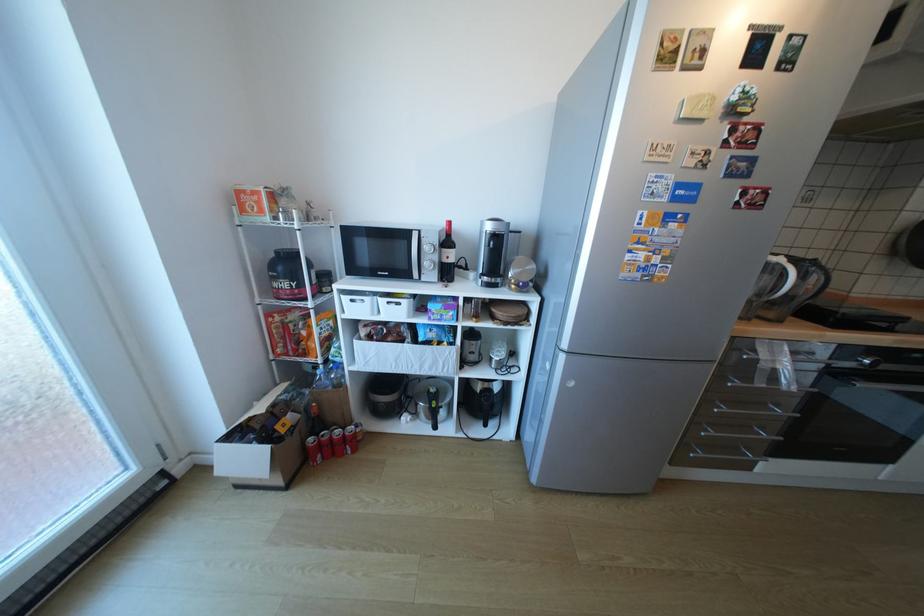
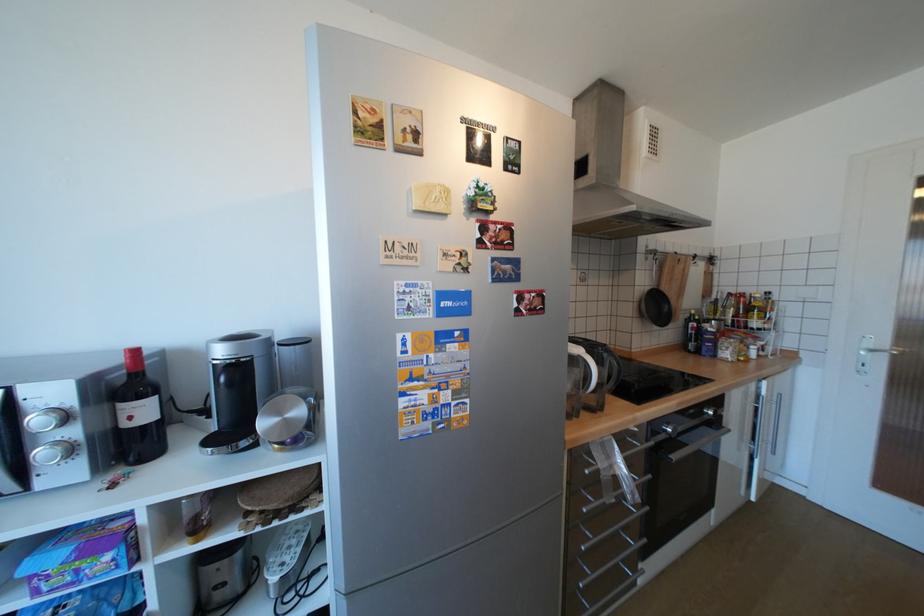
Locate, in the second image, the point that corresponds to (x=797, y=384) in the first image.

(641, 493)